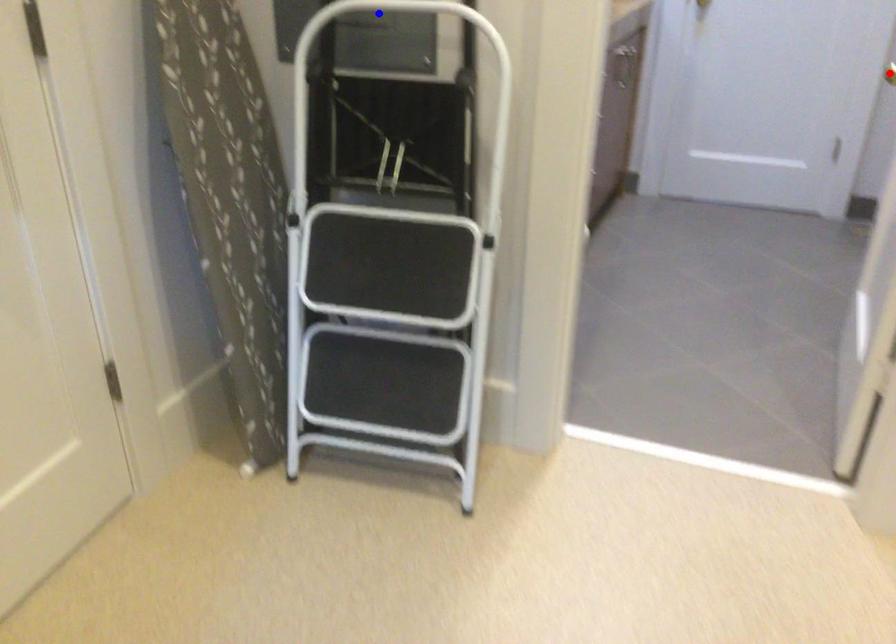
Question: Which of the two points in the image is closer to the camera?

Choices:
 (A) Blue point is closer.
 (B) Red point is closer.

Answer: (A)